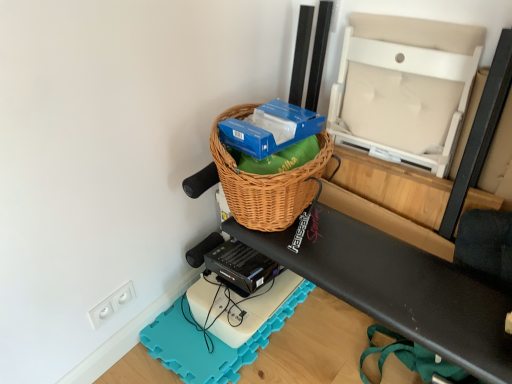
This screenshot has width=512, height=384. I want to click on white plastic electric outlet at lower left, so click(111, 304).

What is the approximate width of white plastic electric outlet at lower left?

The width of white plastic electric outlet at lower left is 1.09 inches.

Locate an element on the screen. white foam yoga mat at lower center is located at coordinates (211, 340).

What do you see at coordinates (211, 340) in the screenshot?
I see `white foam yoga mat at lower center` at bounding box center [211, 340].

The image size is (512, 384). Describe the element at coordinates (404, 88) in the screenshot. I see `beige fabric chair at upper right, the 1th wide when ordered from top to bottom` at that location.

You are a GUI agent. You are given a task and a screenshot of the screen. Output one action in this format:
    pyautogui.click(x=<x>, y=<y>)
    Task: Click on the woven brown picnic basket at upper center
    The width and height of the screenshot is (512, 384).
    Given the screenshot: What is the action you would take?
    pyautogui.click(x=266, y=182)

How much space does woven brown basket at center, arranged as the 2th wide when viewed from the top, occupy horizontally?

1.16 meters.

You are a GUI agent. You are given a task and a screenshot of the screen. Output one action in this format:
    pyautogui.click(x=<x>, y=<y>)
    Task: Click on the white plastic electric outlet at lower left
    The width and height of the screenshot is (512, 384).
    Given the screenshot: What is the action you would take?
    pyautogui.click(x=111, y=304)

Can we say white plastic electric outlet at lower left lies outside blue cardboard box at upper center?

Yes, white plastic electric outlet at lower left is located beyond the bounds of blue cardboard box at upper center.

In the scene shown: From a real-world perspective, is white plastic electric outlet at lower left positioned under blue cardboard box at upper center based on gravity?

Yes, from a real-world perspective, white plastic electric outlet at lower left is under blue cardboard box at upper center.

Based on the photo, from the image's perspective, relative to blue cardboard box at upper center, is white plastic electric outlet at lower left above or below?

white plastic electric outlet at lower left is situated lower than blue cardboard box at upper center in the image.

Image resolution: width=512 pixels, height=384 pixels. I want to click on box above the white plastic electric outlet at lower left (from a real-world perspective), so click(x=269, y=131).

From the image's perspective, is beige fabric chair at upper right, which appears as the 2th wide when ordered from the bottom, above or below woven brown picnic basket at upper center?

Based on their image positions, beige fabric chair at upper right, which appears as the 2th wide when ordered from the bottom, is located above woven brown picnic basket at upper center.

Does point (353, 54) lie behind point (283, 213)?

Yes, point (353, 54) is farther from viewer.

Considering the relative positions of beige fabric chair at upper right, the 1th wide when ordered from top to bottom, and woven brown picnic basket at upper center in the image provided, is beige fabric chair at upper right, the 1th wide when ordered from top to bottom, to the right of woven brown picnic basket at upper center from the viewer's perspective?

Yes.

From the image's perspective, is white plastic electric outlet at lower left located above woven brown basket at center, which is counted as the 1th wide, starting from the bottom?

Yes, from the image's perspective, white plastic electric outlet at lower left is on top of woven brown basket at center, which is counted as the 1th wide, starting from the bottom.

Is white plastic electric outlet at lower left touching woven brown basket at center, which is counted as the 1th wide, starting from the bottom?

No, white plastic electric outlet at lower left is not in contact with woven brown basket at center, which is counted as the 1th wide, starting from the bottom.

Is white plastic electric outlet at lower left facing towards woven brown basket at center, which is counted as the 1th wide, starting from the bottom?

No, white plastic electric outlet at lower left is not turned towards woven brown basket at center, which is counted as the 1th wide, starting from the bottom.

Does white plastic electric outlet at lower left appear on the left side of woven brown basket at center, which is counted as the 1th wide, starting from the bottom?

Yes, white plastic electric outlet at lower left is to the left of woven brown basket at center, which is counted as the 1th wide, starting from the bottom.

Is beige fabric chair at upper right, which appears as the 2th wide when ordered from the bottom, inside woven brown picnic basket at upper center?

Definitely not — beige fabric chair at upper right, which appears as the 2th wide when ordered from the bottom, is not inside woven brown picnic basket at upper center.

What are the coordinates of `picnic basket on the left of the beige fabric chair at upper right, the 1th wide when ordered from top to bottom` in the screenshot? It's located at click(266, 182).

Is point (210, 135) farther from viewer compared to point (357, 96)?

No, it is in front of (357, 96).

Which object is thinner, beige fabric chair at upper right, which appears as the 2th wide when ordered from the bottom, or woven brown basket at center, which is counted as the 1th wide, starting from the bottom?

beige fabric chair at upper right, which appears as the 2th wide when ordered from the bottom, is thinner.

Is beige fabric chair at upper right, the 1th wide when ordered from top to bottom, facing towards woven brown basket at center, which is counted as the 1th wide, starting from the bottom?

No, beige fabric chair at upper right, the 1th wide when ordered from top to bottom, is not turned towards woven brown basket at center, which is counted as the 1th wide, starting from the bottom.

Is beige fabric chair at upper right, which appears as the 2th wide when ordered from the bottom, smaller than woven brown basket at center, which is counted as the 1th wide, starting from the bottom?

Incorrect, beige fabric chair at upper right, which appears as the 2th wide when ordered from the bottom, is not smaller in size than woven brown basket at center, which is counted as the 1th wide, starting from the bottom.

Considering the sizes of objects woven brown basket at center, which is counted as the 1th wide, starting from the bottom, and beige fabric chair at upper right, which appears as the 2th wide when ordered from the bottom, in the image provided, who is taller, woven brown basket at center, which is counted as the 1th wide, starting from the bottom, or beige fabric chair at upper right, which appears as the 2th wide when ordered from the bottom,?

beige fabric chair at upper right, which appears as the 2th wide when ordered from the bottom, is taller.

From a real-world perspective, is woven brown basket at center, arranged as the 2th wide when viewed from the top, physically above beige fabric chair at upper right, which appears as the 2th wide when ordered from the bottom?

Actually, woven brown basket at center, arranged as the 2th wide when viewed from the top, is physically below beige fabric chair at upper right, which appears as the 2th wide when ordered from the bottom, in the real world.

The width and height of the screenshot is (512, 384). In the image, there is a woven brown basket at center, arranged as the 2th wide when viewed from the top. Identify the location of wide above it (from the image's perspective). (404, 88).

Where is `electric outlet behind the blue cardboard box at upper center`? The width and height of the screenshot is (512, 384). electric outlet behind the blue cardboard box at upper center is located at coordinates (111, 304).

Can you confirm if blue cardboard box at upper center is taller than white plastic electric outlet at lower left?

In fact, blue cardboard box at upper center may be shorter than white plastic electric outlet at lower left.

From the picture: Is blue cardboard box at upper center directly adjacent to white plastic electric outlet at lower left?

blue cardboard box at upper center is not next to white plastic electric outlet at lower left, and they're not touching.

This screenshot has width=512, height=384. I want to click on box that appears on the right of white plastic electric outlet at lower left, so click(269, 131).

The width and height of the screenshot is (512, 384). I want to click on wide that is the 1st one when counting forward from the woven brown picnic basket at upper center, so click(404, 88).

Looking at the image, which one is located closer to woven brown basket at center, which is counted as the 1th wide, starting from the bottom, woven brown picnic basket at upper center or white foam yoga mat at lower center?

Based on the image, woven brown picnic basket at upper center appears to be nearer to woven brown basket at center, which is counted as the 1th wide, starting from the bottom.

Looking at the image, which one is located further to white foam yoga mat at lower center, beige fabric chair at upper right, which appears as the 2th wide when ordered from the bottom, or woven brown basket at center, which is counted as the 1th wide, starting from the bottom?

beige fabric chair at upper right, which appears as the 2th wide when ordered from the bottom, is further to white foam yoga mat at lower center.

Which object lies further to the anchor point beige fabric chair at upper right, the 1th wide when ordered from top to bottom, woven brown basket at center, arranged as the 2th wide when viewed from the top, or blue cardboard box at upper center?

Among the two, woven brown basket at center, arranged as the 2th wide when viewed from the top, is located further to beige fabric chair at upper right, the 1th wide when ordered from top to bottom.

Which object lies further to the anchor point white foam yoga mat at lower center, woven brown basket at center, which is counted as the 1th wide, starting from the bottom, or blue cardboard box at upper center?

The object further to white foam yoga mat at lower center is blue cardboard box at upper center.

Looking at the image, which one is located further to woven brown picnic basket at upper center, blue cardboard box at upper center or white plastic electric outlet at lower left?

The object further to woven brown picnic basket at upper center is white plastic electric outlet at lower left.

Which object lies nearer to the anchor point woven brown picnic basket at upper center, blue cardboard box at upper center or woven brown basket at center, which is counted as the 1th wide, starting from the bottom?

Based on the image, blue cardboard box at upper center appears to be nearer to woven brown picnic basket at upper center.

Considering their positions, is blue cardboard box at upper center positioned closer to woven brown picnic basket at upper center than beige fabric chair at upper right, which appears as the 2th wide when ordered from the bottom?

Among the two, blue cardboard box at upper center is located nearer to woven brown picnic basket at upper center.

Based on their spatial positions, is white plastic electric outlet at lower left or woven brown picnic basket at upper center closer to blue cardboard box at upper center?

Among the two, woven brown picnic basket at upper center is located nearer to blue cardboard box at upper center.

Identify the location of picnic basket between beige fabric chair at upper right, the 1th wide when ordered from top to bottom, and woven brown basket at center, arranged as the 2th wide when viewed from the top, vertically. (266, 182).

In order to click on box located between white plastic electric outlet at lower left and woven brown picnic basket at upper center in the left-right direction in this screenshot , I will do `click(269, 131)`.

Image resolution: width=512 pixels, height=384 pixels. I want to click on yoga mat between white plastic electric outlet at lower left and beige fabric chair at upper right, which appears as the 2th wide when ordered from the bottom, from left to right, so click(x=211, y=340).

Where is `electric outlet between woven brown picnic basket at upper center and white foam yoga mat at lower center in the vertical direction`? The height and width of the screenshot is (384, 512). electric outlet between woven brown picnic basket at upper center and white foam yoga mat at lower center in the vertical direction is located at coordinates (111, 304).